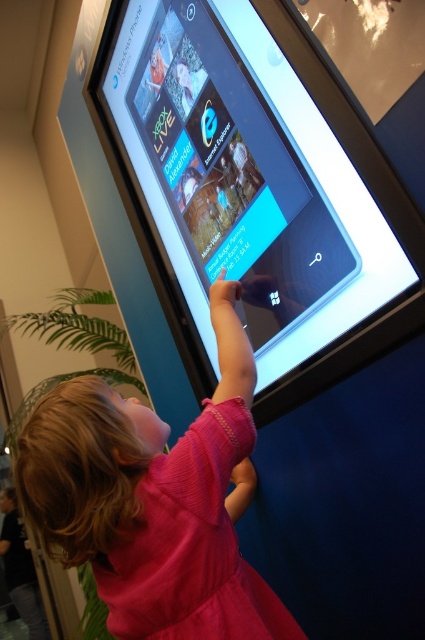
Question: Which point appears closest to the camera in this image?

Choices:
 (A) (223, 448)
 (B) (121, 566)

Answer: (B)

Question: Can you confirm if matte black touchscreen at upper center is smaller than pink knit dress at lower left?

Choices:
 (A) no
 (B) yes

Answer: (A)

Question: Is pink fabric dress at center thinner than pink knit dress at lower left?

Choices:
 (A) no
 (B) yes

Answer: (A)

Question: Which of the following is the closest to the observer?

Choices:
 (A) (282, 218)
 (B) (180, 618)

Answer: (B)

Question: Does pink fabric dress at center have a greater width compared to pink knit dress at lower left?

Choices:
 (A) no
 (B) yes

Answer: (B)

Question: Among these points, which one is farthest from the camera?

Choices:
 (A) (95, 538)
 (B) (158, 634)

Answer: (B)